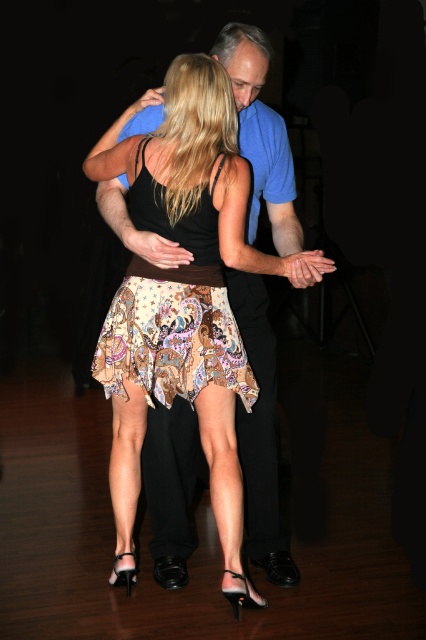
Question: Which object appears closest to the camera in this image?

Choices:
 (A) paisley-patterned skirt at center
 (B) printed fabric skirt at center

Answer: (B)

Question: Which point is farther to the camera?

Choices:
 (A) (235, 268)
 (B) (127, 356)

Answer: (B)

Question: Can you confirm if printed fabric skirt at center is bigger than paisley-patterned skirt at center?

Choices:
 (A) yes
 (B) no

Answer: (A)

Question: Is the position of printed fabric skirt at center more distant than that of paisley-patterned skirt at center?

Choices:
 (A) yes
 (B) no

Answer: (B)

Question: Among these objects, which one is farthest from the camera?

Choices:
 (A) printed fabric skirt at center
 (B) paisley-patterned skirt at center

Answer: (B)

Question: Does printed fabric skirt at center have a greater width compared to paisley-patterned skirt at center?

Choices:
 (A) yes
 (B) no

Answer: (A)